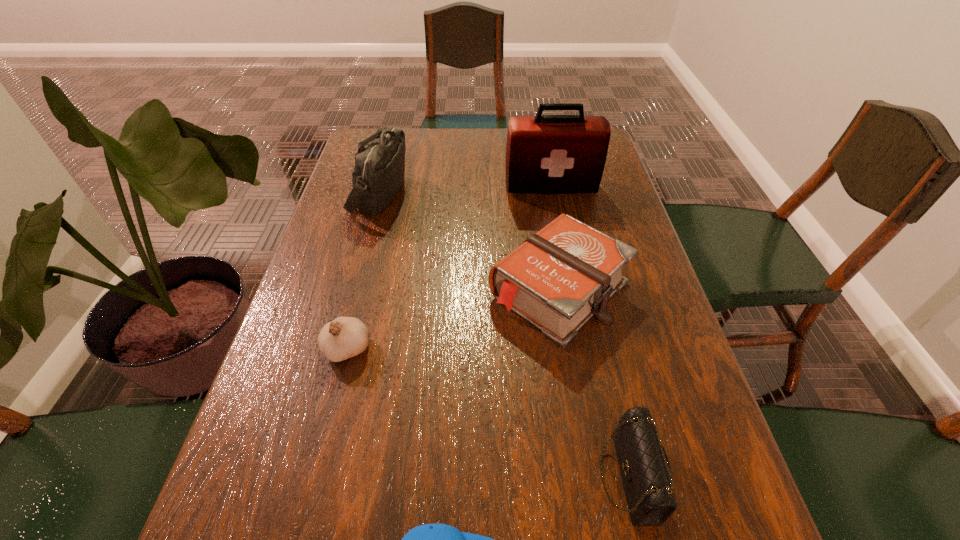
Find the location of a particular element. blank region between the shoulder bag and the first aid kit is located at coordinates (466, 190).

The image size is (960, 540). I want to click on vacant area that lies between the clutch bag and the shoulder bag, so [x=504, y=335].

Identify the location of vacant space in between the garlic and the second tallest object. (363, 271).

Where is `free spot between the Bible and the fifth shortest object`? The width and height of the screenshot is (960, 540). free spot between the Bible and the fifth shortest object is located at coordinates (469, 241).

In order to click on vacant point located between the tallest object and the clutch bag in this screenshot , I will do `click(589, 332)`.

Select which object appears as the second closest to the Bible. Please provide its 2D coordinates. Your answer should be formatted as a tuple, i.e. [(x, y)], where the tuple contains the x and y coordinates of a point satisfying the conditions above.

[(545, 154)]

Find the location of `object that is the closest to the second tallest object`. object that is the closest to the second tallest object is located at coordinates (557, 279).

Find the location of `vacant area that satisfies the following two spatial constraints: 1. on the side of the tallest object with the cross symbol; 2. at the front padded panel of the shoulder bag`. vacant area that satisfies the following two spatial constraints: 1. on the side of the tallest object with the cross symbol; 2. at the front padded panel of the shoulder bag is located at coordinates (552, 193).

Identify the location of free point that satisfies the following two spatial constraints: 1. on the side of the tallest object with the cross symbol; 2. at the front padded panel of the shoulder bag. The width and height of the screenshot is (960, 540). (552, 193).

The height and width of the screenshot is (540, 960). Identify the location of blank area in the image that satisfies the following two spatial constraints: 1. at the front padded panel of the shoulder bag; 2. on the back side of the garlic. (338, 349).